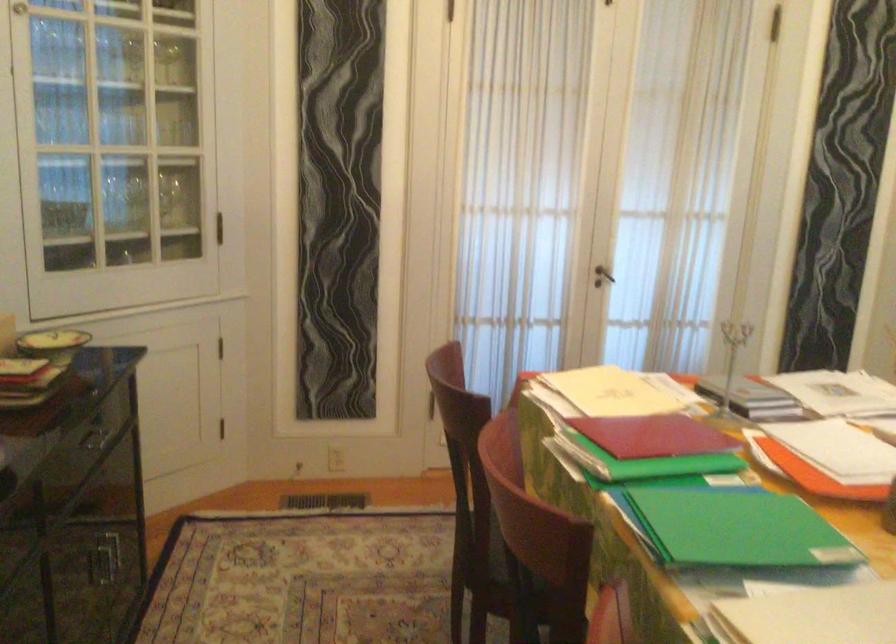
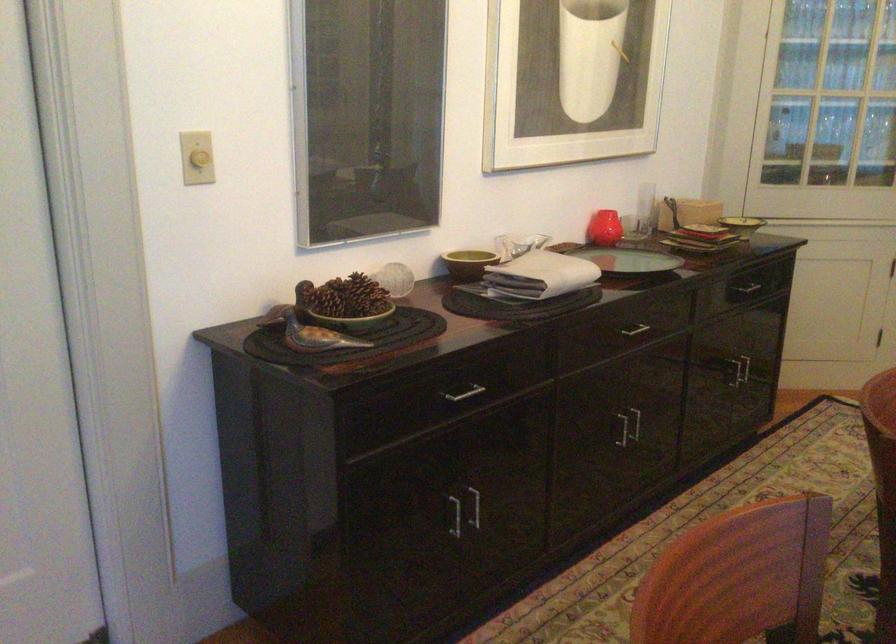
In the second image, find the point that corresponds to point 116,565 in the first image.

(737, 371)